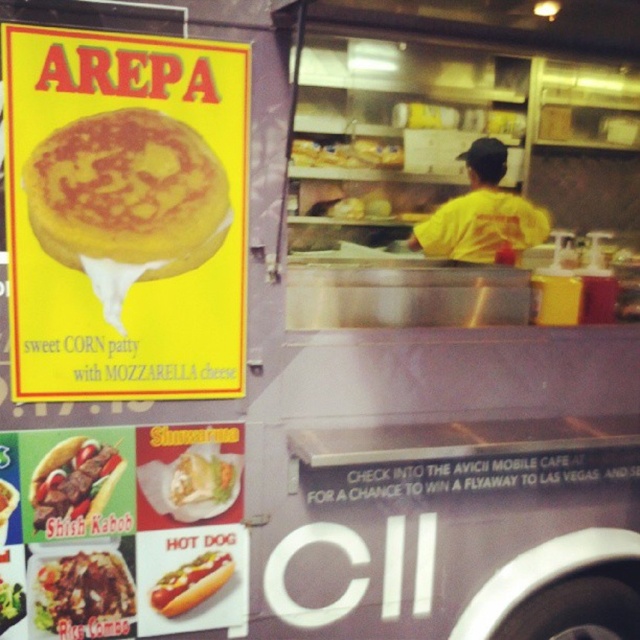
Is brown rice at center bigger than shiny yellow hot dog at center?

Yes, brown rice at center is bigger than shiny yellow hot dog at center.

Between point (35, 600) and point (84, 522), which one is positioned behind?

Point (84, 522)

At what (x,y) coordinates should I click in order to perform the action: click on brown rice at center. Please return your answer as a coordinate pair (x, y). Looking at the image, I should click on (81, 593).

Which is below, brown rice at center or shiny white hot dog at lower center?

brown rice at center

Who is higher up, brown rice at center or shiny white hot dog at lower center?

Positioned higher is shiny white hot dog at lower center.

You are a GUI agent. You are given a task and a screenshot of the screen. Output one action in this format:
    pyautogui.click(x=<x>, y=<y>)
    Task: Click on the brown rice at center
    The width and height of the screenshot is (640, 640).
    Given the screenshot: What is the action you would take?
    pyautogui.click(x=81, y=593)

Is point (44, 173) in front of point (109, 481)?

That is True.

Between point (81, 145) and point (72, 470), which one is positioned in front?

Positioned in front is point (81, 145).

Does point (148, 40) lie behind point (77, 492)?

That is False.

Where is `yellow matte arepa at upper left`? yellow matte arepa at upper left is located at coordinates (125, 214).